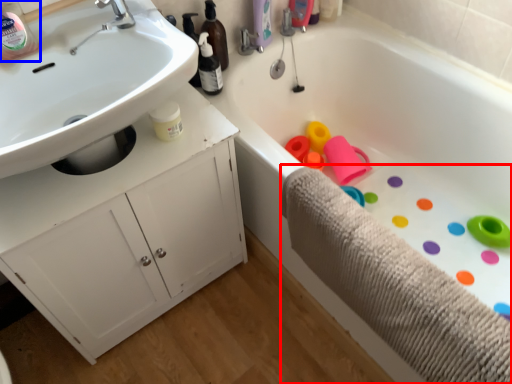
Question: Which object appears farthest to the camera in this image, bath towel (highlighted by a red box) or bottle (highlighted by a blue box)?

Choices:
 (A) bath towel
 (B) bottle

Answer: (B)